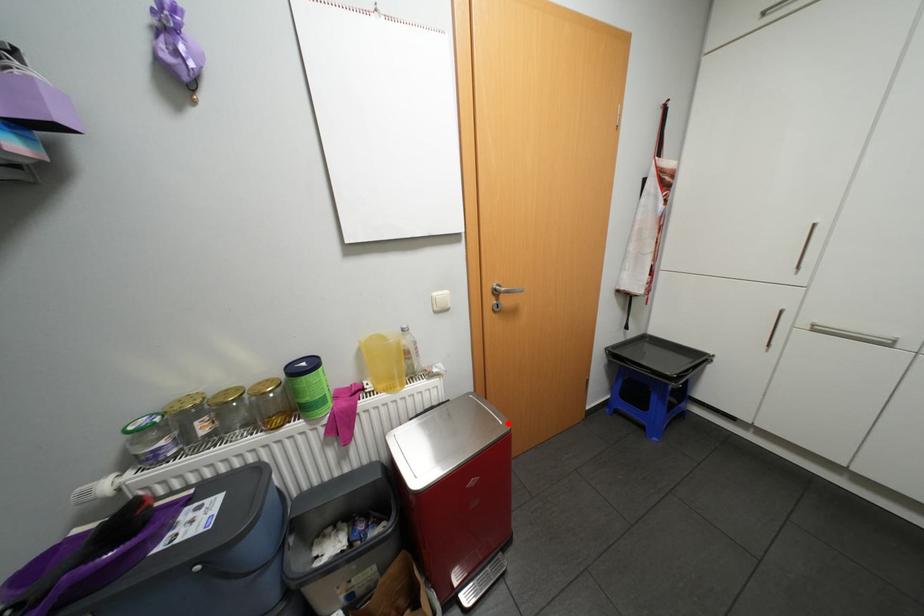
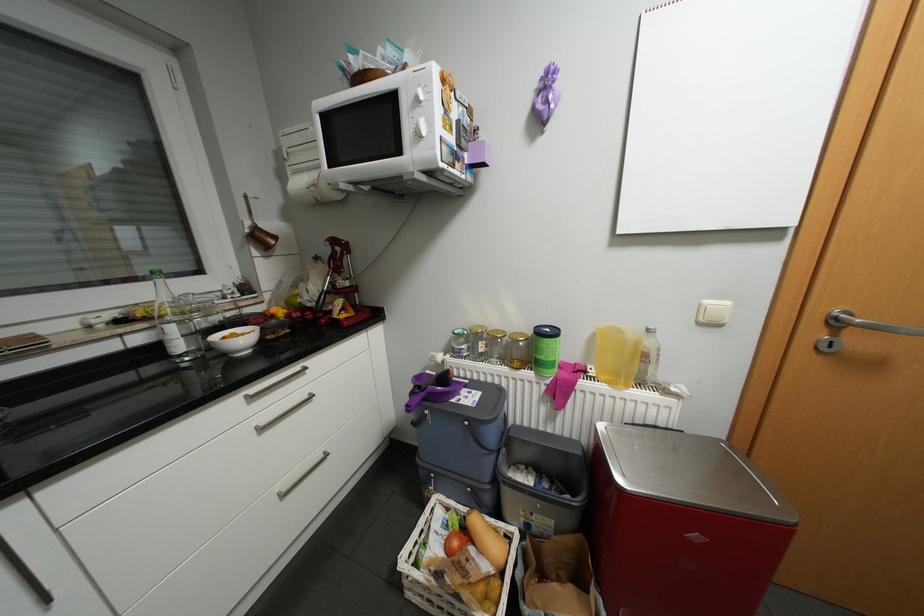
Where in the second image is the point corresponding to the highlighted location from the first image?

(784, 504)